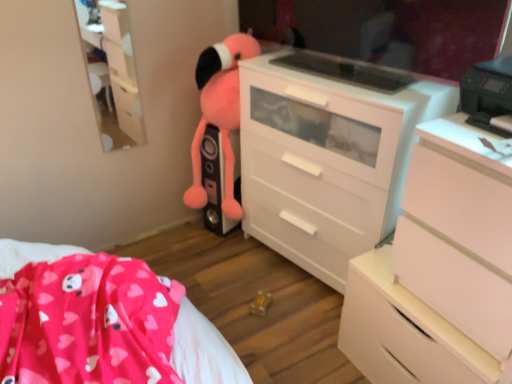
The height and width of the screenshot is (384, 512). I want to click on free space above white glossy chest of drawers at center, acting as the 2th chest of drawers starting from the front (from a real-world perspective), so click(x=343, y=78).